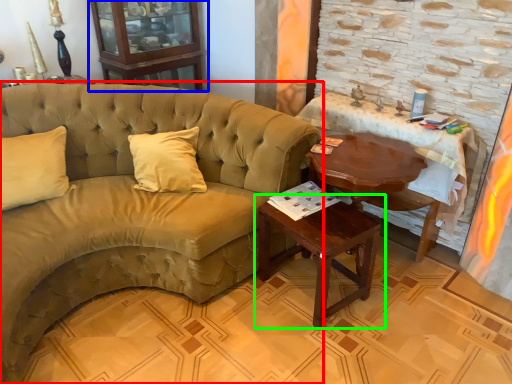
Question: Which object is the farthest from studio couch (highlighted by a red box)? Choose among these: armoire (highlighted by a blue box) or table (highlighted by a green box).

Choices:
 (A) armoire
 (B) table

Answer: (A)